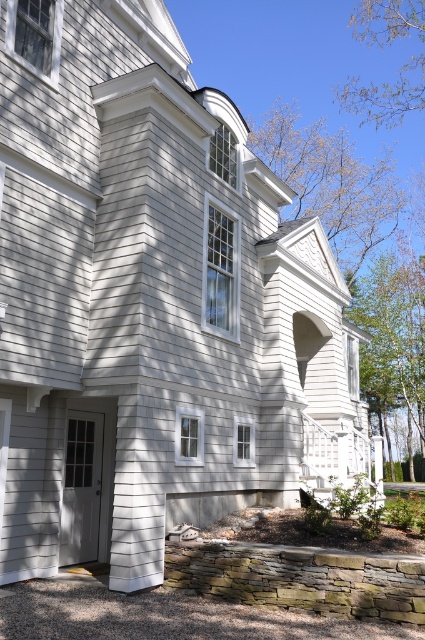
You are standing in front of the house and see a point marked at coordinates [331,182]. What object is located at that point?

The point at [331,182] indicates a brown leafy tree at upper center.

You are a landscape architect assessing the property. You need to determine which tree, the brown leafy tree at upper center or the brown leafy tree at upper right, requires more space for growth. Based on the scene, which tree would you recommend focusing on first?

The brown leafy tree at upper center is larger in size than the brown leafy tree at upper right, so it likely requires more space for growth and should be addressed first.